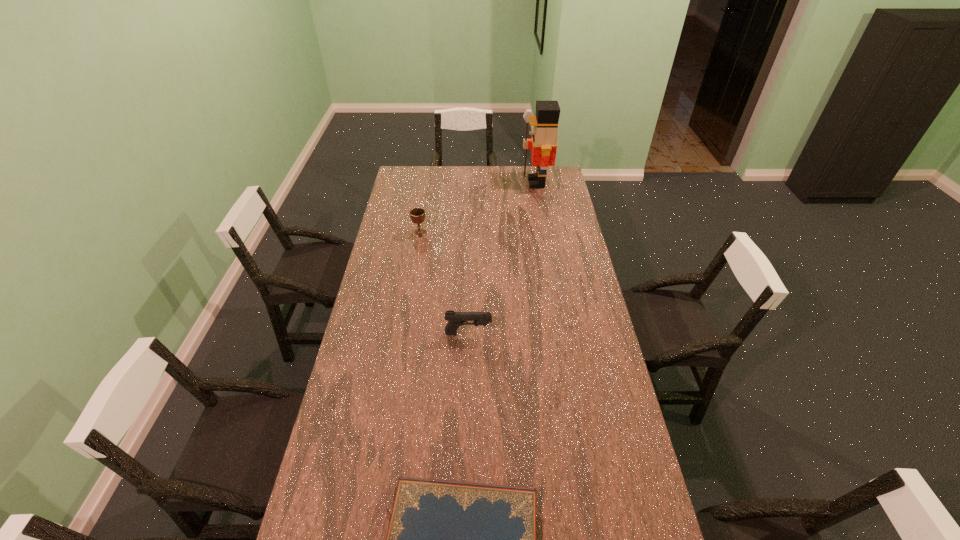
Find the location of `object located in the far edge section of the desktop`. object located in the far edge section of the desktop is located at coordinates (543, 143).

Locate an element on the screen. The width and height of the screenshot is (960, 540). object situated at the left edge is located at coordinates (417, 215).

I want to click on object located at the right edge, so click(543, 143).

At what (x,y) coordinates should I click in order to perform the action: click on object located at the far right corner. Please return your answer as a coordinate pair (x, y). Image resolution: width=960 pixels, height=540 pixels. Looking at the image, I should click on (543, 143).

This screenshot has width=960, height=540. I want to click on free location at the far edge, so click(439, 186).

In order to click on blank area at the left edge in this screenshot , I will do `click(360, 436)`.

The width and height of the screenshot is (960, 540). I want to click on vacant space at the right edge, so click(541, 208).

At what (x,y) coordinates should I click in order to perform the action: click on empty location between the third nearest object and the farthest object. Please return your answer as a coordinate pair (x, y). Image resolution: width=960 pixels, height=540 pixels. Looking at the image, I should click on (478, 208).

At what (x,y) coordinates should I click in order to perform the action: click on empty space that is in between the third farthest object and the tallest object. Please return your answer as a coordinate pair (x, y). This screenshot has height=540, width=960. Looking at the image, I should click on [x=502, y=258].

In order to click on vacant area that lies between the farthest object and the leftmost object in this screenshot , I will do `click(478, 208)`.